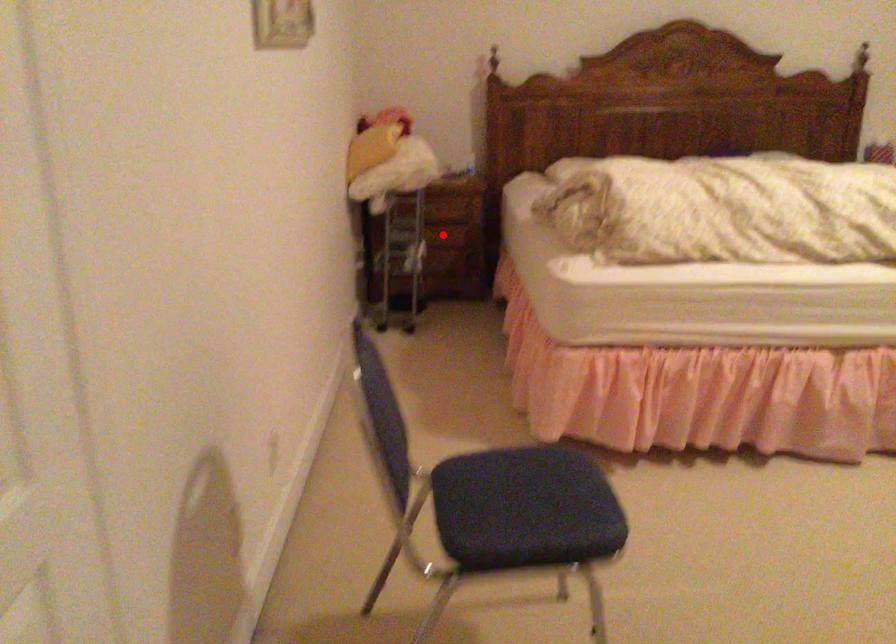
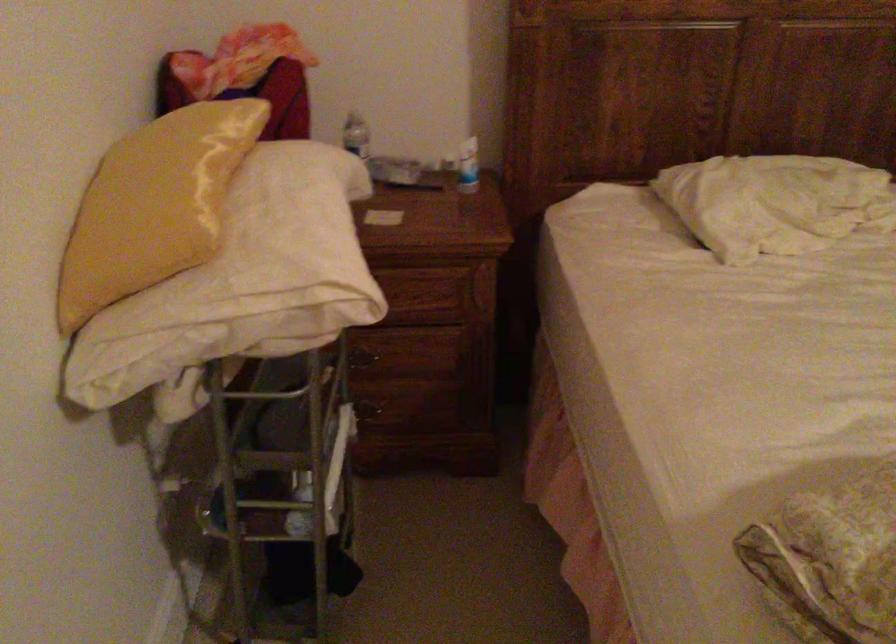
Question: A red point is marked in image1. In image2, is the corresponding 3D point closer to the camera or farther? Reply with the corresponding letter.

Choices:
 (A) The corresponding 3D point is closer.
 (B) The corresponding 3D point is farther.

Answer: (A)